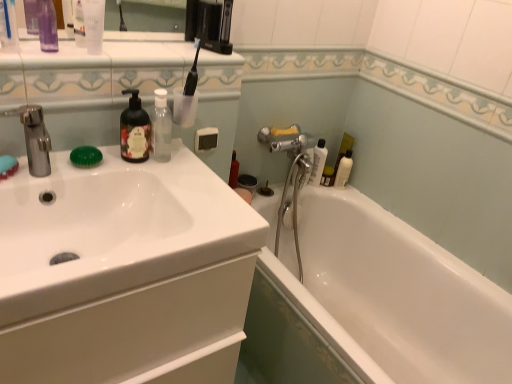
Question: Is white glossy bottle at upper right, which is counted as the third toiletry, starting from the front, in front of white glossy sink at left?

Choices:
 (A) no
 (B) yes

Answer: (A)

Question: Does white glossy bottle at upper right, the third toiletry in the left-to-right sequence, have a lesser height compared to white glossy sink at left?

Choices:
 (A) yes
 (B) no

Answer: (B)

Question: Can you confirm if white glossy bottle at upper right, which ranks as the 2th toiletry in right-to-left order, is positioned to the right of white glossy sink at left?

Choices:
 (A) yes
 (B) no

Answer: (A)

Question: From a real-world perspective, is white glossy bottle at upper right, which is counted as the third toiletry, starting from the front, over white glossy sink at left?

Choices:
 (A) yes
 (B) no

Answer: (B)

Question: Is white glossy bottle at upper right, the 2th toiletry viewed from the back, smaller than white glossy sink at left?

Choices:
 (A) yes
 (B) no

Answer: (A)

Question: Would you say white glossy sink at left is part of white glossy bottle at upper right, the 2th toiletry viewed from the back,'s contents?

Choices:
 (A) yes
 (B) no

Answer: (B)

Question: Would you say white glossy bathtub at lower right is part of transparent plastic bottle at upper left, positioned as the 1th toiletry in left-to-right order,'s contents?

Choices:
 (A) no
 (B) yes

Answer: (A)

Question: From the image's perspective, is transparent plastic bottle at upper left, which is the 4th toiletry in back-to-front order, above white glossy bathtub at lower right?

Choices:
 (A) no
 (B) yes

Answer: (B)

Question: Is transparent plastic bottle at upper left, which is the 4th toiletry in back-to-front order, smaller than white glossy bathtub at lower right?

Choices:
 (A) yes
 (B) no

Answer: (A)

Question: Is there a large distance between transparent plastic bottle at upper left, positioned as the 1th toiletry in left-to-right order, and white glossy bathtub at lower right?

Choices:
 (A) yes
 (B) no

Answer: (A)

Question: Is transparent plastic bottle at upper left, the fourth toiletry positioned from the right, in contact with white glossy bathtub at lower right?

Choices:
 (A) yes
 (B) no

Answer: (B)

Question: From a real-world perspective, is transparent plastic bottle at upper left, positioned as the 1th toiletry in left-to-right order, over white glossy bathtub at lower right?

Choices:
 (A) yes
 (B) no

Answer: (A)

Question: Is clear plastic bottle at upper left, marked as the second mouthwash in a bottom-to-top arrangement, to the right of white glossy bottle at upper right, the third toiletry in the left-to-right sequence, from the viewer's perspective?

Choices:
 (A) yes
 (B) no

Answer: (B)